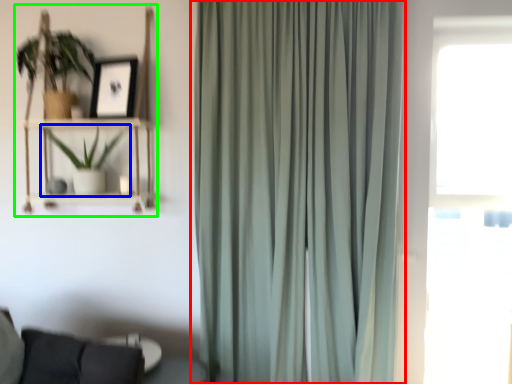
Question: Considering the real-world distances, which object is closest to curtain (highlighted by a red box)? houseplant (highlighted by a blue box) or bookshelf (highlighted by a green box).

Choices:
 (A) houseplant
 (B) bookshelf

Answer: (B)